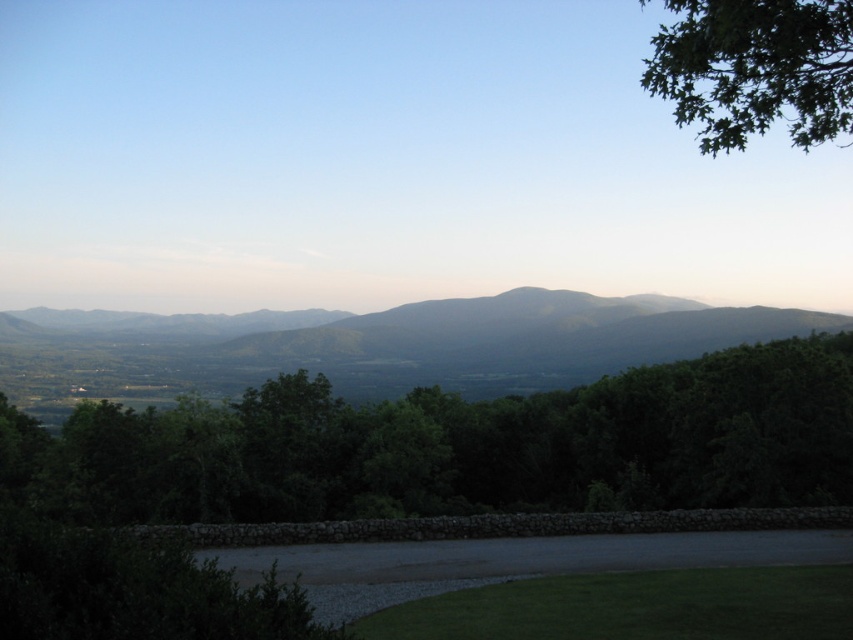
Who is shorter, green leafy tree at center or green leafy tree at upper right?

With less height is green leafy tree at center.

What do you see at coordinates (457, 445) in the screenshot?
I see `green leafy tree at center` at bounding box center [457, 445].

Is point (244, 458) in front of point (784, 67)?

No, it is behind (784, 67).

Image resolution: width=853 pixels, height=640 pixels. In order to click on green leafy tree at center in this screenshot , I will do `click(457, 445)`.

Who is higher up, green leafy tree at center or green textured mountain at center?

green textured mountain at center is higher up.

Is point (335, 492) positioned in front of point (474, 339)?

Yes, it is.

Which is in front, point (187, 401) or point (51, 332)?

Point (187, 401) is more forward.

This screenshot has width=853, height=640. What are the coordinates of `green leafy tree at center` in the screenshot? It's located at (457, 445).

Is green textured mountain at center positioned behind green leafy tree at upper right?

Yes, it is.

Does green textured mountain at center appear under green leafy tree at upper right?

Yes, green textured mountain at center is below green leafy tree at upper right.

Which is behind, point (7, 337) or point (786, 54)?

Positioned behind is point (7, 337).

You are a GUI agent. You are given a task and a screenshot of the screen. Output one action in this format:
    pyautogui.click(x=<x>, y=<y>)
    Task: Click on the green textured mountain at center
    Image resolution: width=853 pixels, height=640 pixels.
    Given the screenshot: What is the action you would take?
    pyautogui.click(x=375, y=344)